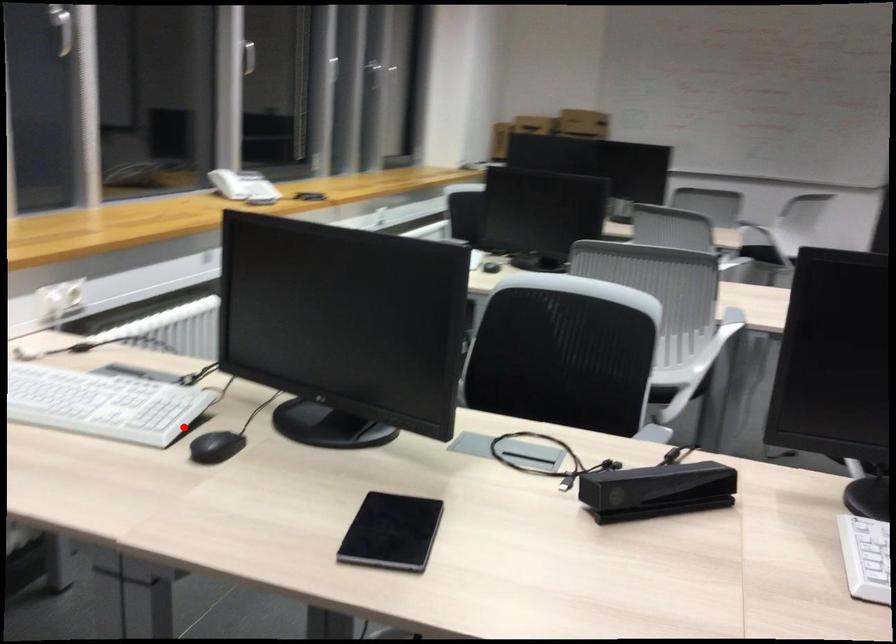
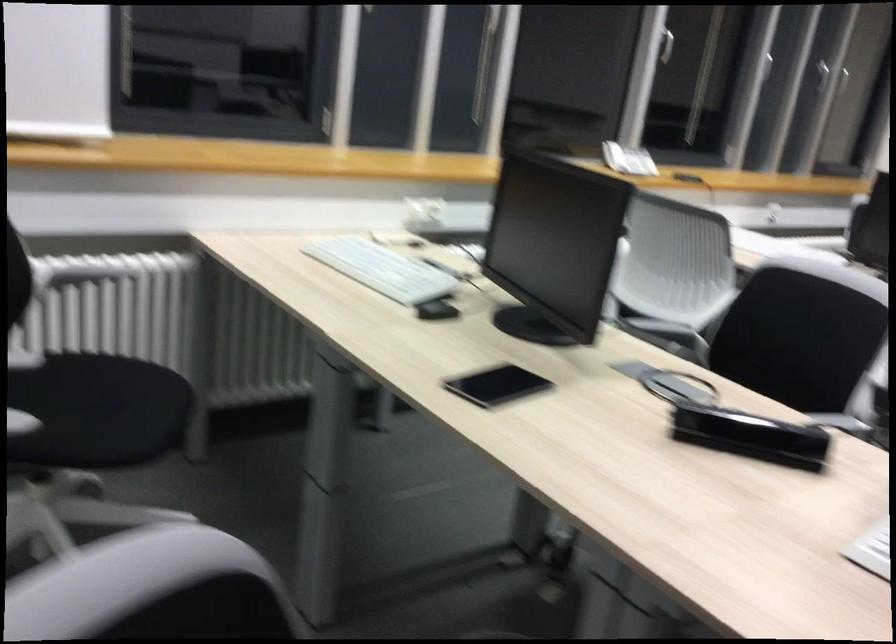
Question: I am providing you with two images of the same scene from different viewpoints. In image1, a red point is highlighted. Considering the same 3D point in image2, which of the following is correct?

Choices:
 (A) It is closer
 (B) It is farther

Answer: (B)